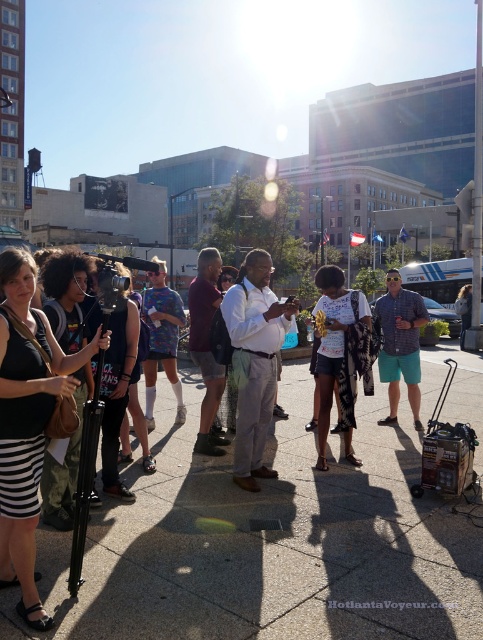
Question: Which point is closer to the camera?

Choices:
 (A) maroon fabric shirt at center
 (B) white shirt at center

Answer: (B)

Question: Does plaid shirt at center appear on the right side of maroon fabric shirt at center?

Choices:
 (A) no
 (B) yes

Answer: (B)

Question: Can you confirm if gray concrete pavement at center is positioned to the right of white matte shirt at center?

Choices:
 (A) no
 (B) yes

Answer: (A)

Question: Which object is positioned farthest from the white matte shirt at center?

Choices:
 (A) maroon fabric shirt at center
 (B) gray concrete pavement at center
 (C) white shirt at center

Answer: (B)

Question: Which object is closer to the camera taking this photo?

Choices:
 (A) white shirt at center
 (B) maroon fabric shirt at center

Answer: (A)

Question: In this image, where is gray concrete pavement at center located relative to plaid shirt at center?

Choices:
 (A) below
 (B) above

Answer: (A)